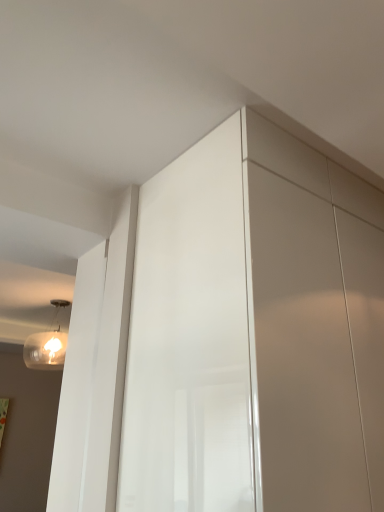
This screenshot has width=384, height=512. I want to click on glossy white dresser at center, so click(231, 338).

Image resolution: width=384 pixels, height=512 pixels. What do you see at coordinates (231, 338) in the screenshot? I see `glossy white dresser at center` at bounding box center [231, 338].

Image resolution: width=384 pixels, height=512 pixels. Find the location of `translucent glass light fixture at upper left`. translucent glass light fixture at upper left is located at coordinates (45, 350).

What do you see at coordinates (45, 350) in the screenshot? The height and width of the screenshot is (512, 384). I see `translucent glass light fixture at upper left` at bounding box center [45, 350].

In order to face translucent glass light fixture at upper left, should I rotate leftwards or rightwards?

Rotate left and turn 19.462 degrees.

Locate an element on the screen. The width and height of the screenshot is (384, 512). glossy white dresser at center is located at coordinates (231, 338).

Looking at this image, is glossy white dresser at center to the right of translucent glass light fixture at upper left from the viewer's perspective?

Indeed, glossy white dresser at center is positioned on the right side of translucent glass light fixture at upper left.

Which object is further away from the camera taking this photo, glossy white dresser at center or translucent glass light fixture at upper left?

translucent glass light fixture at upper left is more distant.

Does point (317, 356) lie in front of point (26, 346)?

Yes, point (317, 356) is closer to viewer.

From the image's perspective, is glossy white dresser at center located above or below translucent glass light fixture at upper left?

glossy white dresser at center is above translucent glass light fixture at upper left.

From a real-world perspective, is glossy white dresser at center located higher than translucent glass light fixture at upper left?

Incorrect, from a real-world perspective, glossy white dresser at center is lower than translucent glass light fixture at upper left.

In terms of width, does glossy white dresser at center look wider or thinner when compared to translucent glass light fixture at upper left?

Considering their sizes, glossy white dresser at center looks broader than translucent glass light fixture at upper left.

Between glossy white dresser at center and translucent glass light fixture at upper left, which one has more height?

With more height is glossy white dresser at center.

Between glossy white dresser at center and translucent glass light fixture at upper left, which one has larger size?

Bigger between the two is glossy white dresser at center.

Is translucent glass light fixture at upper left inside glossy white dresser at center?

No, translucent glass light fixture at upper left is not inside glossy white dresser at center.

Does glossy white dresser at center touch translucent glass light fixture at upper left?

No, glossy white dresser at center is not with translucent glass light fixture at upper left.

Is glossy white dresser at center facing towards translucent glass light fixture at upper left?

No, glossy white dresser at center is not facing towards translucent glass light fixture at upper left.

From the picture: Can you tell me how much glossy white dresser at center and translucent glass light fixture at upper left differ in facing direction?

glossy white dresser at center and translucent glass light fixture at upper left are facing 172 degrees away from each other.

Where is `light fixture below the glossy white dresser at center (from the image's perspective)`? The height and width of the screenshot is (512, 384). light fixture below the glossy white dresser at center (from the image's perspective) is located at coordinates (45, 350).

Does translucent glass light fixture at upper left appear on the right side of glossy white dresser at center?

Incorrect, translucent glass light fixture at upper left is not on the right side of glossy white dresser at center.

Does translucent glass light fixture at upper left come in front of glossy white dresser at center?

No.

Is point (46, 348) closer to camera compared to point (146, 506)?

No, (46, 348) is behind (146, 506).

In the scene shown: From the image's perspective, who appears lower, translucent glass light fixture at upper left or glossy white dresser at center?

translucent glass light fixture at upper left appears lower in the image.

From a real-world perspective, is translucent glass light fixture at upper left positioned above or below glossy white dresser at center?

translucent glass light fixture at upper left is above glossy white dresser at center.

Looking at their sizes, would you say translucent glass light fixture at upper left is wider or thinner than glossy white dresser at center?

In the image, translucent glass light fixture at upper left appears to be more narrow than glossy white dresser at center.

In terms of height, does translucent glass light fixture at upper left look taller or shorter compared to glossy white dresser at center?

Considering their sizes, translucent glass light fixture at upper left has less height than glossy white dresser at center.

Is translucent glass light fixture at upper left bigger or smaller than glossy white dresser at center?

translucent glass light fixture at upper left is smaller than glossy white dresser at center.

Is translucent glass light fixture at upper left situated inside glossy white dresser at center or outside?

translucent glass light fixture at upper left cannot be found inside glossy white dresser at center.

Are translucent glass light fixture at upper left and glossy white dresser at center far apart?

translucent glass light fixture at upper left is far away from glossy white dresser at center.

Is translucent glass light fixture at upper left aimed at glossy white dresser at center?

No, translucent glass light fixture at upper left is not oriented towards glossy white dresser at center.

How different are the orientations of translucent glass light fixture at upper left and glossy white dresser at center in degrees?

The facing directions of translucent glass light fixture at upper left and glossy white dresser at center are 172 degrees apart.

Measure the distance from translucent glass light fixture at upper left to glossy white dresser at center.

translucent glass light fixture at upper left and glossy white dresser at center are 3.07 meters apart from each other.

Identify the location of dresser directly beneath the translucent glass light fixture at upper left (from a real-world perspective). The image size is (384, 512). (231, 338).

Locate an element on the screen. dresser that is in front of the translucent glass light fixture at upper left is located at coordinates (231, 338).

Identify the location of light fixture on the left of glossy white dresser at center. The image size is (384, 512). (45, 350).